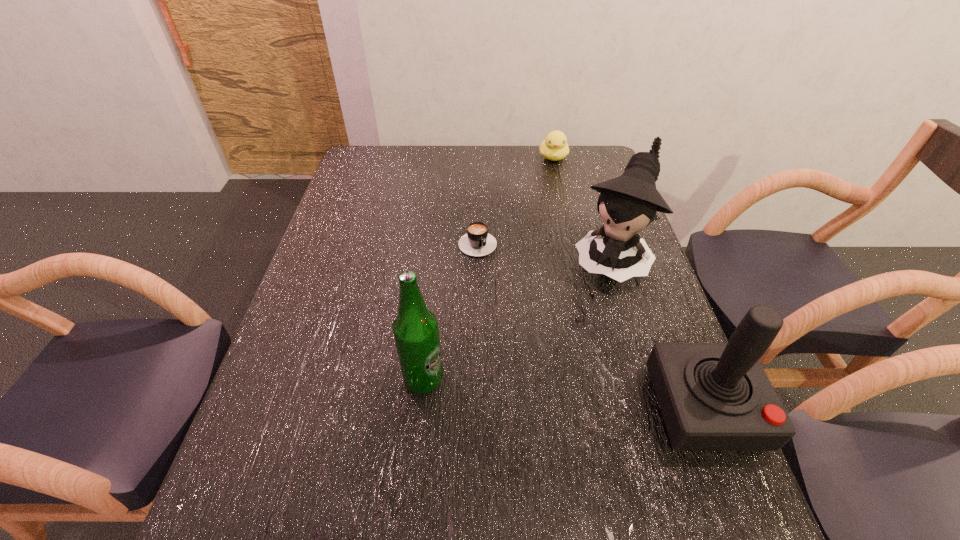
You are a GUI agent. You are given a task and a screenshot of the screen. Output one action in this format:
    pyautogui.click(x=<x>, y=<y>)
    Task: Click on the closest object to the doll
    The width and height of the screenshot is (960, 540).
    Given the screenshot: What is the action you would take?
    pyautogui.click(x=477, y=242)